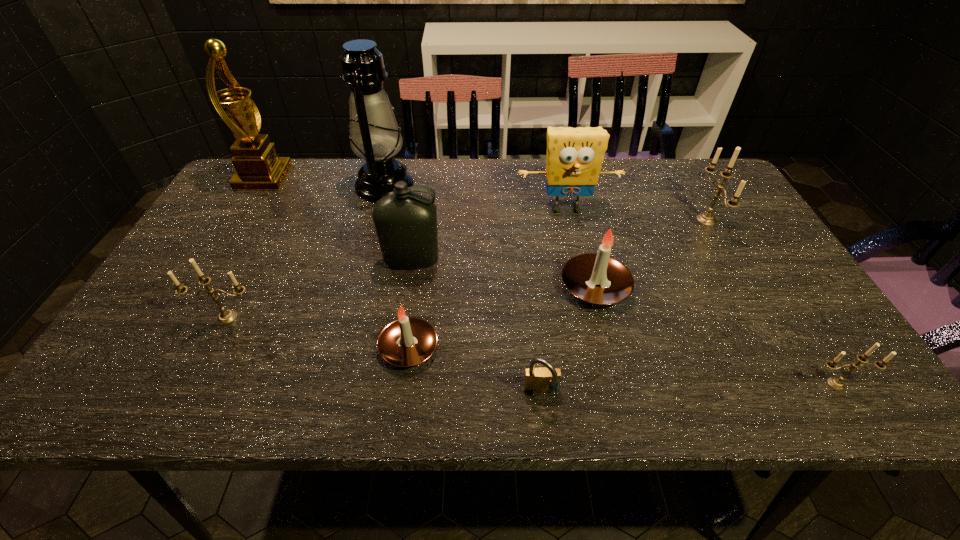
Find the location of a particular element. This screenshot has height=540, width=960. candle that is at the left edge is located at coordinates (226, 317).

Find the location of `object that is at the far left corner`. object that is at the far left corner is located at coordinates (258, 167).

Locate an element on the screen. object at the far right corner is located at coordinates (707, 219).

Identify the location of object present at the near right corner. This screenshot has height=540, width=960. (837, 384).

Locate an element on the screen. free space at the far edge is located at coordinates pos(535,185).

The image size is (960, 540). I want to click on vacant space at the near edge, so click(759, 389).

At what (x,y) coordinates should I click in order to perform the action: click on free space at the left edge of the desktop. Please return your answer as a coordinate pair (x, y). The height and width of the screenshot is (540, 960). Looking at the image, I should click on (139, 358).

Find the location of a particular element. blank space at the right edge of the desktop is located at coordinates (774, 363).

Locate an element on the screen. free spot between the padlock and the sponge is located at coordinates [x=554, y=301].

Where is `empty space that is in between the leftmost candle and the award`? The image size is (960, 540). empty space that is in between the leftmost candle and the award is located at coordinates (246, 248).